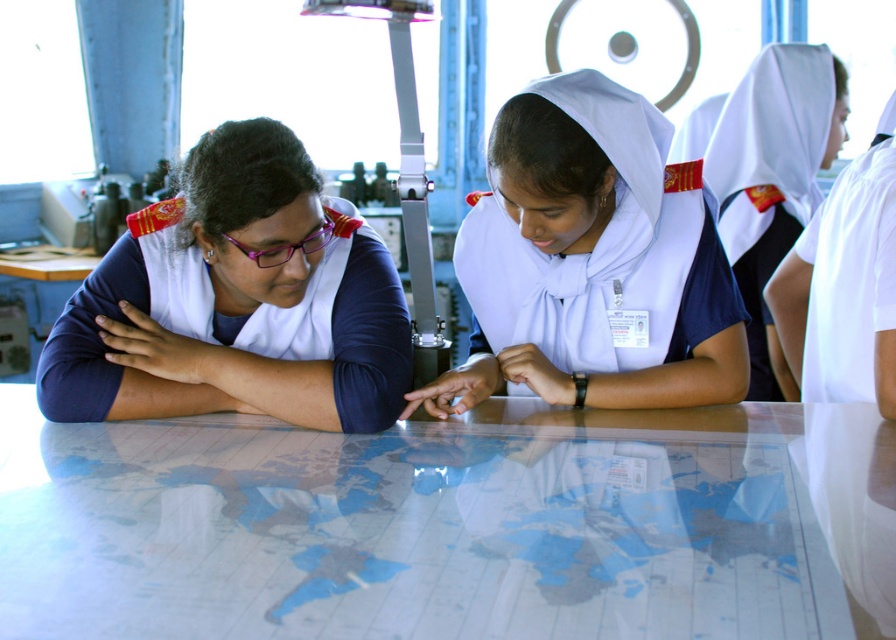
Who is positioned more to the left, white uniform at upper right or purple plastic glasses at upper left?

From the viewer's perspective, purple plastic glasses at upper left appears more on the left side.

Is white uniform at upper right smaller than purple plastic glasses at upper left?

No, white uniform at upper right is not smaller than purple plastic glasses at upper left.

Which is behind, point (728, 154) or point (260, 259)?

The point (728, 154) is behind.

The width and height of the screenshot is (896, 640). I want to click on white uniform at upper right, so click(773, 177).

Is matte blue uniform at left smaller than white matte uniform at center?

Correct, matte blue uniform at left occupies less space than white matte uniform at center.

Between point (246, 326) and point (672, 380), which one is positioned behind?

The point (246, 326) is behind.

Where is `matte blue uniform at left`? This screenshot has width=896, height=640. matte blue uniform at left is located at coordinates (237, 301).

Does transparent glass map at center appear over white matte uniform at center?

Incorrect, transparent glass map at center is not positioned above white matte uniform at center.

Is transparent glass map at center further to the viewer compared to white matte uniform at center?

No, it is in front of white matte uniform at center.

Is point (188, 572) farther from viewer compared to point (503, 308)?

That is False.

You are a GUI agent. You are given a task and a screenshot of the screen. Output one action in this format:
    pyautogui.click(x=<x>, y=<y>)
    Task: Click on the transparent glass map at center
    
    Given the screenshot: What is the action you would take?
    pyautogui.click(x=451, y=524)